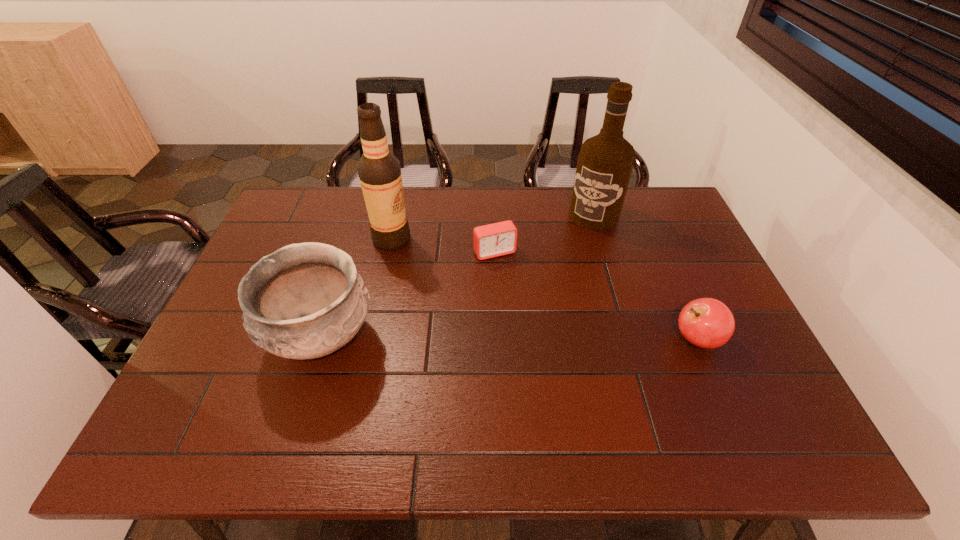
Where is `free spot on the desktop that is between the third shortest object and the second shortest object and is positioned on the label of the right alcohol`? free spot on the desktop that is between the third shortest object and the second shortest object and is positioned on the label of the right alcohol is located at coordinates (506, 339).

The height and width of the screenshot is (540, 960). Identify the location of vacant spot on the desktop that is between the third tallest object and the apple and is positioned on the label of the left alcohol. (516, 339).

This screenshot has height=540, width=960. In order to click on vacant space on the desktop that is between the pottery and the apple and is positioned on the front-facing side of the shortest object in this screenshot , I will do `click(540, 339)`.